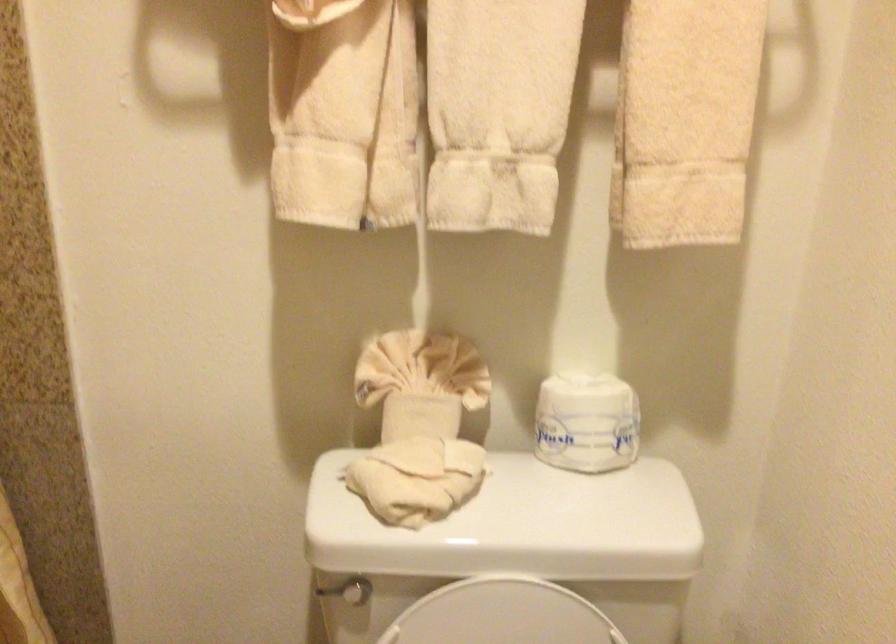
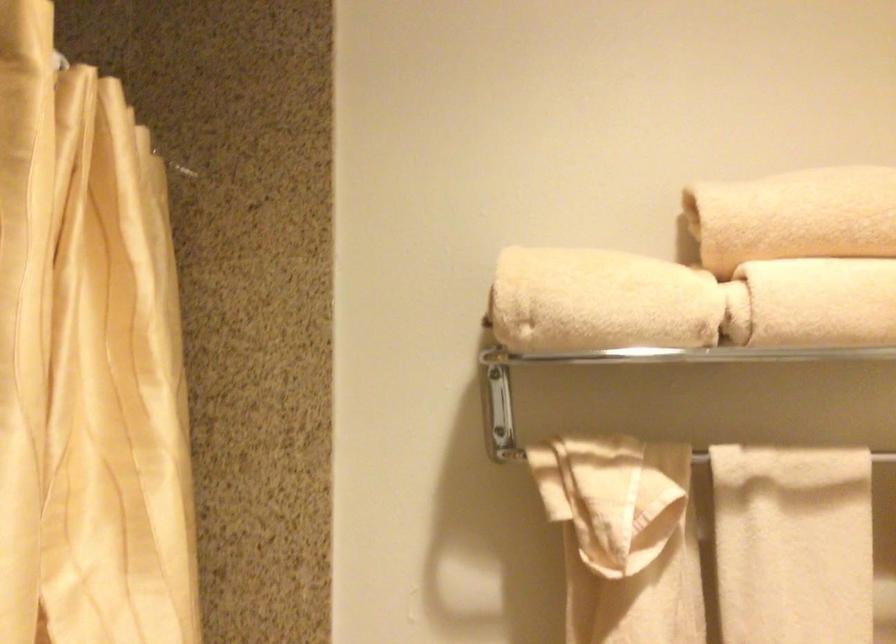
Question: The first image is from the beginning of the video and the second image is from the end. How did the camera likely rotate when shooting the video?

Choices:
 (A) Left
 (B) Right
 (C) Up
 (D) Down

Answer: (C)